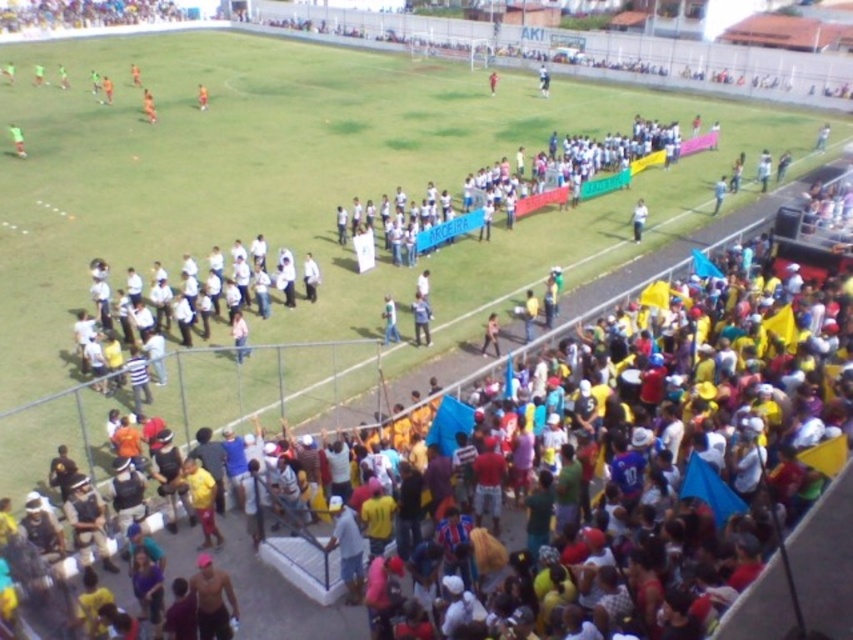
Question: Among these points, which one is nearest to the camera?

Choices:
 (A) (425, 321)
 (B) (206, 88)
 (C) (311, 269)
 (D) (389, 298)

Answer: (A)

Question: Considering the real-world distances, which object is closest to the yellow jersey at center?

Choices:
 (A) matte green jersey at upper left
 (B) white matte shirt at center

Answer: (B)

Question: Which of the following is the farthest from the observer?

Choices:
 (A) orange jersey at center
 (B) orange fabric at center
 (C) matte green jersey at upper left
 (D) matte white shirt at center

Answer: (A)

Question: Is the position of dark blue shirt at center less distant than that of orange jersey at center?

Choices:
 (A) no
 (B) yes

Answer: (B)

Question: Can you confirm if matte green jersey at upper left is wider than orange jersey at upper left?

Choices:
 (A) yes
 (B) no

Answer: (B)

Question: Is white matte shirt at center to the right of orange jersey at center from the viewer's perspective?

Choices:
 (A) yes
 (B) no

Answer: (A)